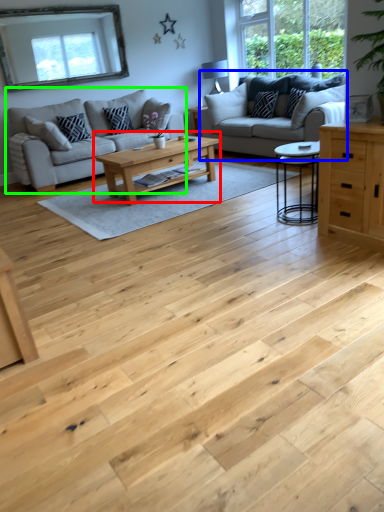
Question: Considering the real-world distances, which object is closest to coffee table (highlighted by a red box)? studio couch (highlighted by a blue box) or studio couch (highlighted by a green box).

Choices:
 (A) studio couch
 (B) studio couch

Answer: (A)